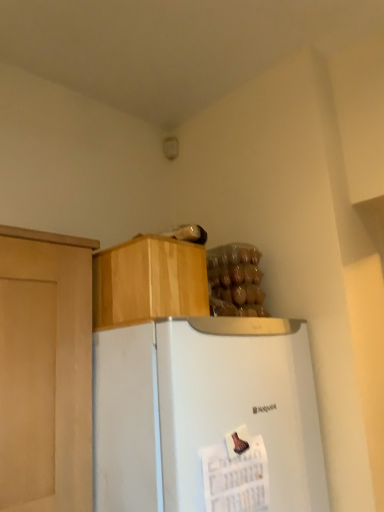
Question: Should I look upward or downward to see white matte refrigerator at center?

Choices:
 (A) up
 (B) down

Answer: (B)

Question: Is wooden cabinet at upper center at the right side of translucent plastic bag of food at upper right?

Choices:
 (A) yes
 (B) no

Answer: (B)

Question: Is wooden cabinet at upper center further to the viewer compared to translucent plastic bag of food at upper right?

Choices:
 (A) yes
 (B) no

Answer: (B)

Question: Would you say wooden cabinet at upper center is outside translucent plastic bag of food at upper right?

Choices:
 (A) no
 (B) yes

Answer: (B)

Question: Is wooden cabinet at upper center not close to translucent plastic bag of food at upper right?

Choices:
 (A) yes
 (B) no

Answer: (B)

Question: Is translucent plastic bag of food at upper right completely or partially inside wooden cabinet at upper center?

Choices:
 (A) yes
 (B) no

Answer: (B)

Question: Is wooden cabinet at upper center smaller than translucent plastic bag of food at upper right?

Choices:
 (A) no
 (B) yes

Answer: (A)

Question: Does white matte refrigerator at center lie in front of translucent plastic bag of food at upper right?

Choices:
 (A) yes
 (B) no

Answer: (A)

Question: Is there a large distance between white matte refrigerator at center and translucent plastic bag of food at upper right?

Choices:
 (A) yes
 (B) no

Answer: (B)

Question: Does white matte refrigerator at center contain translucent plastic bag of food at upper right?

Choices:
 (A) yes
 (B) no

Answer: (B)

Question: From a real-world perspective, does white matte refrigerator at center stand above translucent plastic bag of food at upper right?

Choices:
 (A) yes
 (B) no

Answer: (B)

Question: Does white matte refrigerator at center turn towards translucent plastic bag of food at upper right?

Choices:
 (A) no
 (B) yes

Answer: (A)

Question: Does white matte refrigerator at center have a larger size compared to translucent plastic bag of food at upper right?

Choices:
 (A) no
 (B) yes

Answer: (B)

Question: From the image's perspective, is translucent plastic bag of food at upper right above wooden cabinet at upper center?

Choices:
 (A) yes
 (B) no

Answer: (B)